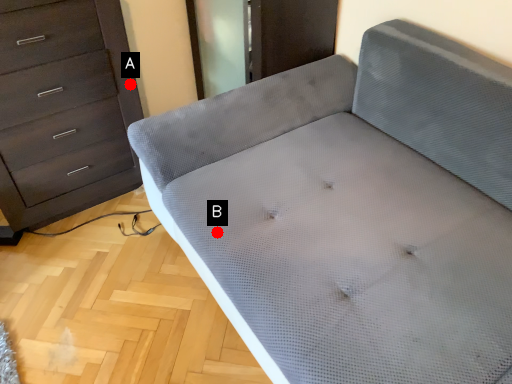
Question: Two points are circled on the image, labeled by A and B beside each circle. Among these points, which one is nearest to the camera?

Choices:
 (A) A is closer
 (B) B is closer

Answer: (B)